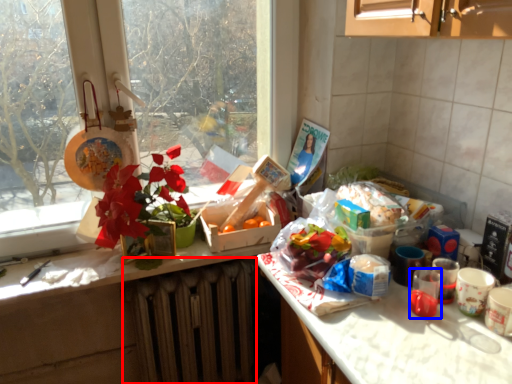
Question: Among these objects, which one is farthest to the camera, radiator (highlighted by a red box) or coffee cup (highlighted by a blue box)?

Choices:
 (A) radiator
 (B) coffee cup

Answer: (A)